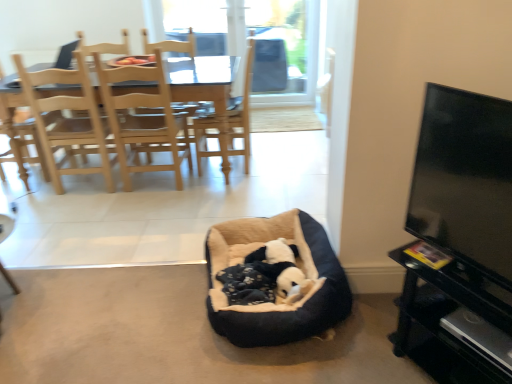
Question: Looking at their shapes, would you say black plush dog bed at center is wider or thinner than black glossy tv stand at lower right?

Choices:
 (A) thin
 (B) wide

Answer: (A)

Question: From a real-world perspective, relative to black glossy tv stand at lower right, is black plush dog bed at center vertically above or below?

Choices:
 (A) above
 (B) below

Answer: (B)

Question: Which object is positioned closest to the soft fleece dog bed at center?

Choices:
 (A) black plush dog bed at center
 (B) black glossy tv stand at lower right
 (C) light brown wood chair at left, the 2th chair positioned from the left
 (D) light wood chair at upper left, the 1th chair positioned from the left
 (E) flat screen tv at right

Answer: (A)

Question: Estimate the real-world distances between objects in this image. Which object is closer to the flat screen tv at right?

Choices:
 (A) black plush dog bed at center
 (B) black glossy tv stand at lower right
 (C) soft fleece dog bed at center
 (D) light wood dining chair at upper left
 (E) light brown wood chair at left, the first chair in the right-to-left sequence

Answer: (B)